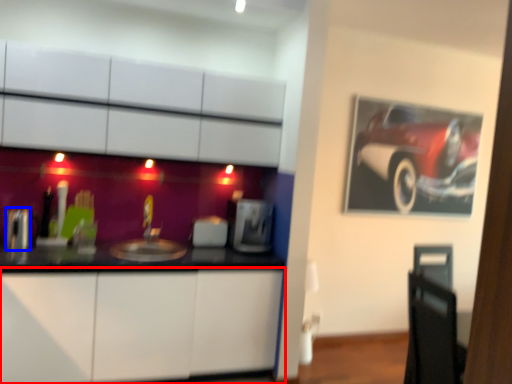
Question: Which of the following is the farthest to the observer, cabinetry (highlighted by a red box) or appliance (highlighted by a blue box)?

Choices:
 (A) cabinetry
 (B) appliance

Answer: (B)